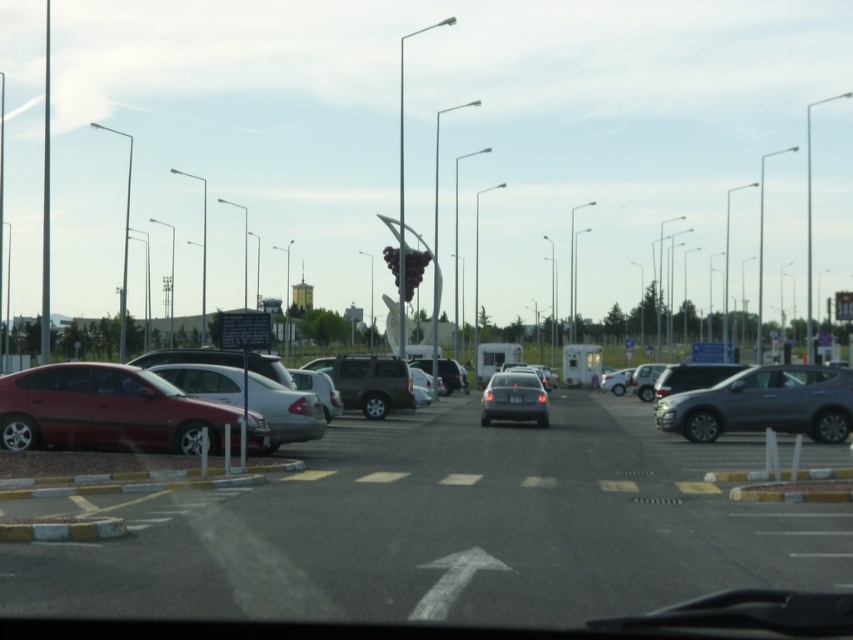
Does metallic gray car at center lie behind satin black sedan at center?

That is False.

Does metallic gray car at center appear over satin black sedan at center?

No.

At what (x,y) coordinates should I click in order to perform the action: click on metallic gray car at center. Please return your answer as a coordinate pair (x, y). This screenshot has width=853, height=640. Looking at the image, I should click on (445, 529).

I want to click on metallic gray car at center, so click(x=445, y=529).

Measure the distance between matte red sedan at left and silver metallic sedan at center-left.

matte red sedan at left is 5.63 feet from silver metallic sedan at center-left.

Who is positioned more to the right, matte red sedan at left or silver metallic sedan at center-left?

silver metallic sedan at center-left is more to the right.

Is point (1, 440) more distant than point (305, 432)?

That is False.

Find the location of a particular element. matte red sedan at left is located at coordinates (107, 410).

Which is in front, point (285, 419) or point (490, 387)?

Point (285, 419) is more forward.

Between silver metallic sedan at center-left and satin black sedan at center, which one is positioned higher?

silver metallic sedan at center-left

Is point (236, 385) farther from camera compared to point (490, 394)?

No, (236, 385) is in front of (490, 394).

This screenshot has width=853, height=640. What are the coordinates of `silver metallic sedan at center-left` in the screenshot? It's located at (285, 410).